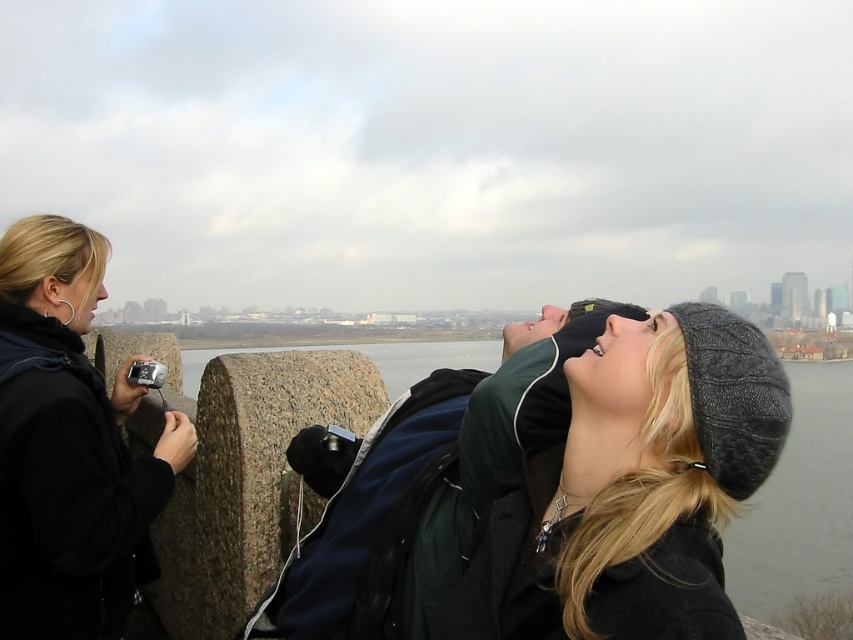
Question: Is dark gray knit hat at upper right positioned behind dark green jacket at center?

Choices:
 (A) no
 (B) yes

Answer: (A)

Question: Which point is closer to the camera taking this photo?

Choices:
 (A) (708, 404)
 (B) (90, 244)

Answer: (A)

Question: Which of the following is the farthest from the observer?

Choices:
 (A) black fabric camera at left
 (B) dark green jacket at center
 (C) dark gray knit hat at upper right

Answer: (B)

Question: Which point is farther to the camera?

Choices:
 (A) dark gray knit hat at upper right
 (B) dark green jacket at center

Answer: (B)

Question: In this image, where is dark green jacket at center located relative to black fabric camera at left?

Choices:
 (A) right
 (B) left

Answer: (A)

Question: Observing the image, what is the correct spatial positioning of dark gray knit hat at upper right in reference to dark green jacket at center?

Choices:
 (A) below
 (B) above

Answer: (A)